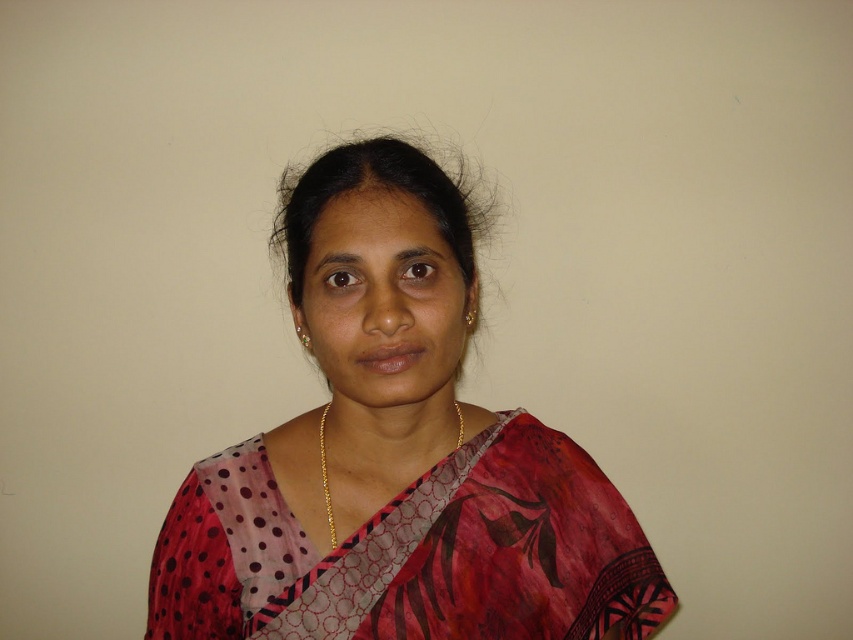
You are a fashion designer who wants to place a new accessory exactly at the center of the image. The image has a polka dot chiffon sari at center. Where should you place the accessory to ensure it aligns with the sari?

The polka dot chiffon sari at center is located at point (413, 552), so you should place the accessory at those coordinates to align with it.